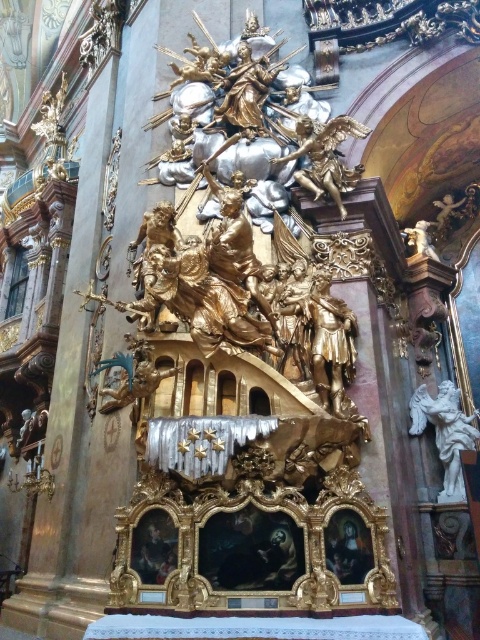
You are an architect designing a new church and want to place a golden statue in the same relative position as the gold polished statue at upper center in the image. What coordinates should you use for the statue?

The gold polished statue at upper center is positioned at coordinates point (324,156), so you should place the statue at those coordinates for the same relative position.

What is located at the point with coordinates (324,156) in the image?

At point (324,156) lies the gold polished statue at upper center.

You are an architect designing a new cathedral and want to ensure the statues on the altar are spaced appropriately for visitors to admire both the gold polished statue at upper center and the white marble angel at right. Given that the average human eye can comfortably view objects spaced between 20 to 30 meters apart, will the current spacing between these two statues allow visitors to comfortably view both?

The gold polished statue at upper center and the white marble angel at right are 23.48 meters apart from each other. Since this distance falls within the comfortable viewing range of 20 to 30 meters, visitors can comfortably view both statues.